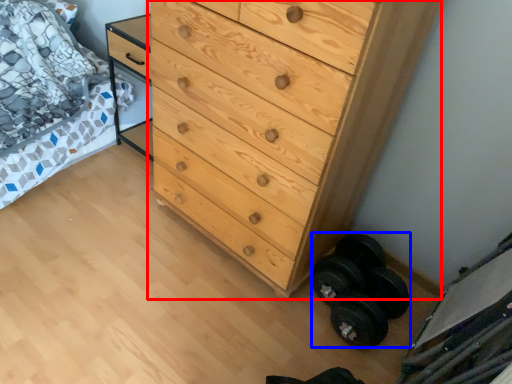
Question: Which object appears farthest to the camera in this image, chest of drawers (highlighted by a red box) or dumbbell (highlighted by a blue box)?

Choices:
 (A) chest of drawers
 (B) dumbbell

Answer: (B)